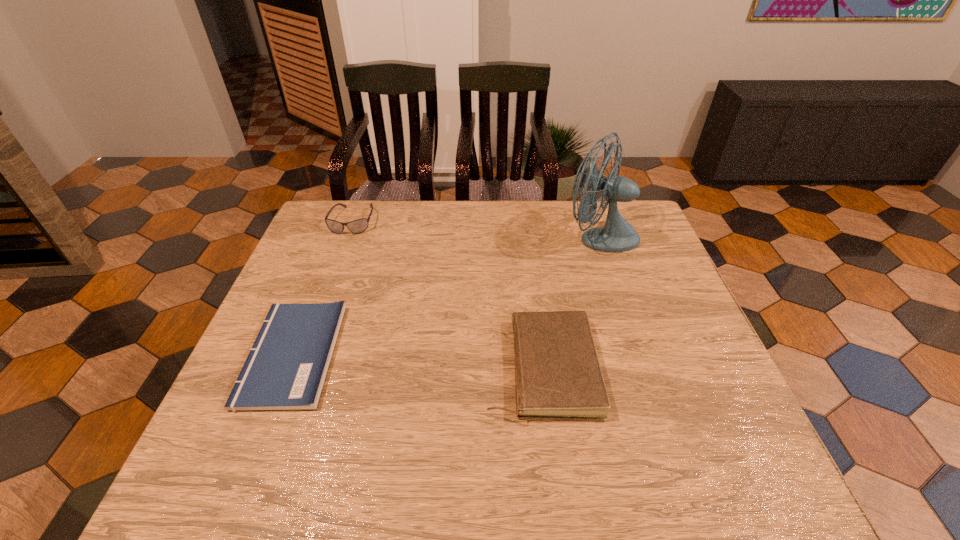
In order to click on vacant space located 0.310m on the spine side of the right paperback book in this screenshot , I will do `click(348, 368)`.

Locate an element on the screen. This screenshot has width=960, height=540. blank area located on the spine side of the right paperback book is located at coordinates (x=397, y=368).

Locate an element on the screen. Image resolution: width=960 pixels, height=540 pixels. free point located 0.100m on the front of the left paperback book is located at coordinates (252, 460).

Find the location of a particular element. This screenshot has width=960, height=540. fan positioned at the far edge is located at coordinates point(617,235).

At what (x,y) coordinates should I click in order to perform the action: click on sunglasses at the far edge. Please return your answer as a coordinate pair (x, y). The height and width of the screenshot is (540, 960). Looking at the image, I should click on (358, 226).

Identify the location of sunglasses that is at the left edge. The height and width of the screenshot is (540, 960). (358, 226).

Find the location of a particular element. paperback book that is at the left edge is located at coordinates (286, 367).

Where is `object at the right edge`? This screenshot has height=540, width=960. object at the right edge is located at coordinates (617, 235).

At what (x,y) coordinates should I click in order to perform the action: click on object that is positioned at the far left corner. Please return your answer as a coordinate pair (x, y). The image size is (960, 540). Looking at the image, I should click on (358, 226).

At what (x,y) coordinates should I click in order to perform the action: click on object present at the far right corner. Please return your answer as a coordinate pair (x, y). This screenshot has height=540, width=960. Looking at the image, I should click on (617, 235).